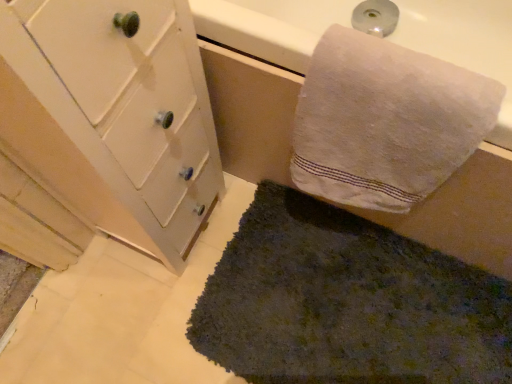
Find the location of a particular element. Image resolution: width=512 pixels, height=384 pixels. vacant space underneath dark green shaggy rug at lower center (from a real-world perspective) is located at coordinates (357, 311).